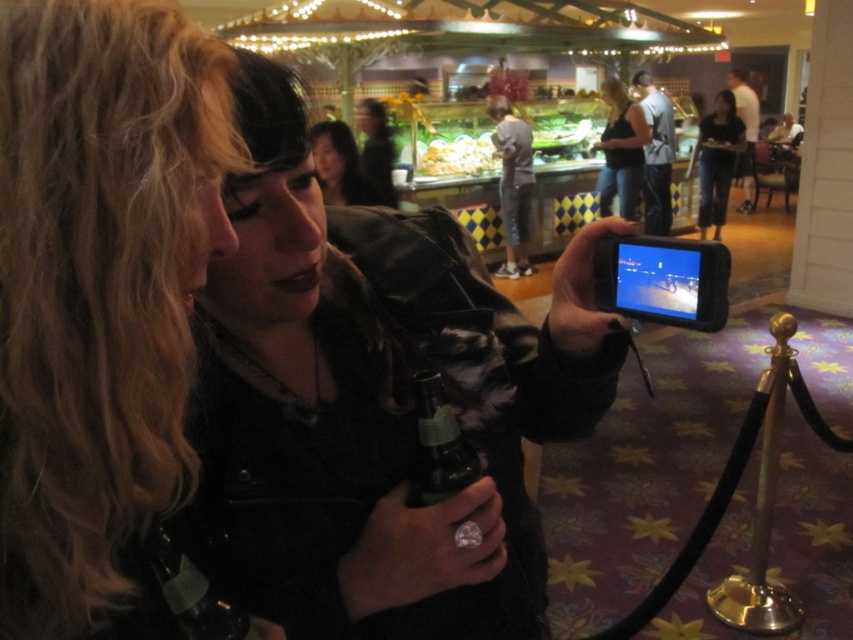
Which is more to the left, matte black jacket at center or smooth black hair at upper center?

smooth black hair at upper center is more to the left.

Can you confirm if matte black jacket at center is wider than smooth black hair at upper center?

Yes.

Locate an element on the screen. The width and height of the screenshot is (853, 640). matte black jacket at center is located at coordinates (376, 400).

Who is more forward, (445, 321) or (206, 177)?

Point (206, 177)

Can you confirm if matte black jacket at center is wider than blonde hair at center?

Correct, the width of matte black jacket at center exceeds that of blonde hair at center.

Which is behind, point (556, 417) or point (49, 109)?

The point (556, 417) is behind.

Where is `matte black jacket at center`? This screenshot has height=640, width=853. matte black jacket at center is located at coordinates (376, 400).

Based on the photo, which of these two, black glossy tablet at right or matte black tank top at center, stands shorter?

Standing shorter between the two is black glossy tablet at right.

Does black glossy tablet at right appear on the right side of matte black tank top at center?

In fact, black glossy tablet at right is to the left of matte black tank top at center.

Locate an element on the screen. The image size is (853, 640). black glossy tablet at right is located at coordinates (663, 280).